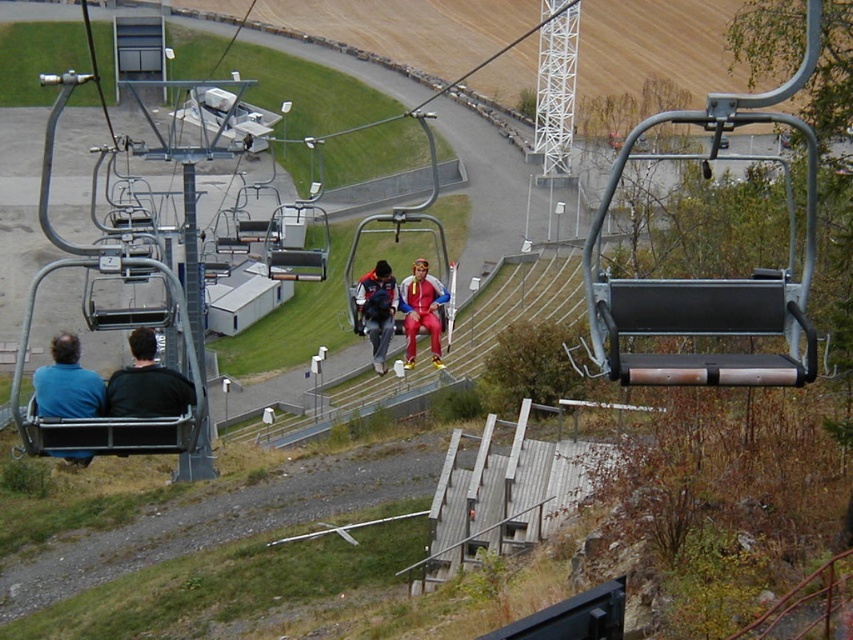
You are standing at the base of the chairlift and want to identify the red fabric suit at center and the matte gray backpack at center. Which object would appear larger in your view?

The red fabric suit at center appears larger because it is closer to the viewer than the matte gray backpack at center.

In the scene shown: You are a photographer trying to capture a clear shot of the blue fabric jacket at left and the matte gray backpack at center. Based on their positions, which object would you need to adjust your camera angle to focus on first if you want to ensure both are in frame?

The blue fabric jacket at left might be wider than the matte gray backpack at center, so you should focus on the blue fabric jacket at left first to ensure it fits within the frame before adjusting for the smaller matte gray backpack at center.

You are a photographer trying to capture a clear photo of the red fabric suit at center and the matte gray backpack at center from the ground. Which object should you focus on first if you want to ensure both are in focus without adjusting the camera settings?

The red fabric suit at center is taller than the matte gray backpack at center, so you should focus on the red fabric suit at center first to ensure both are in focus.